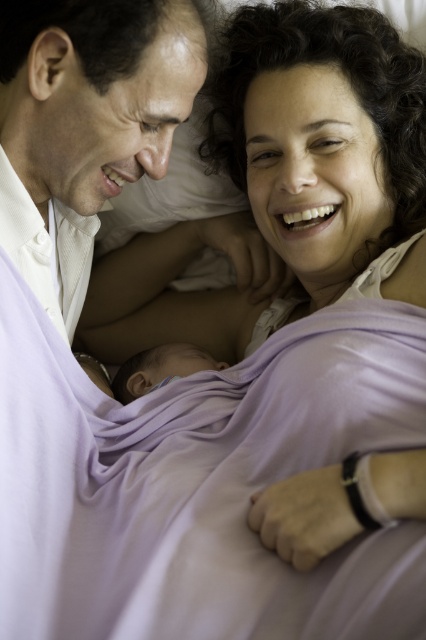
Who is positioned more to the left, white satin shirt at upper left or smooth purple blanket at center?

Positioned to the left is white satin shirt at upper left.

This screenshot has width=426, height=640. Find the location of `white satin shirt at upper left`. white satin shirt at upper left is located at coordinates pyautogui.click(x=86, y=125).